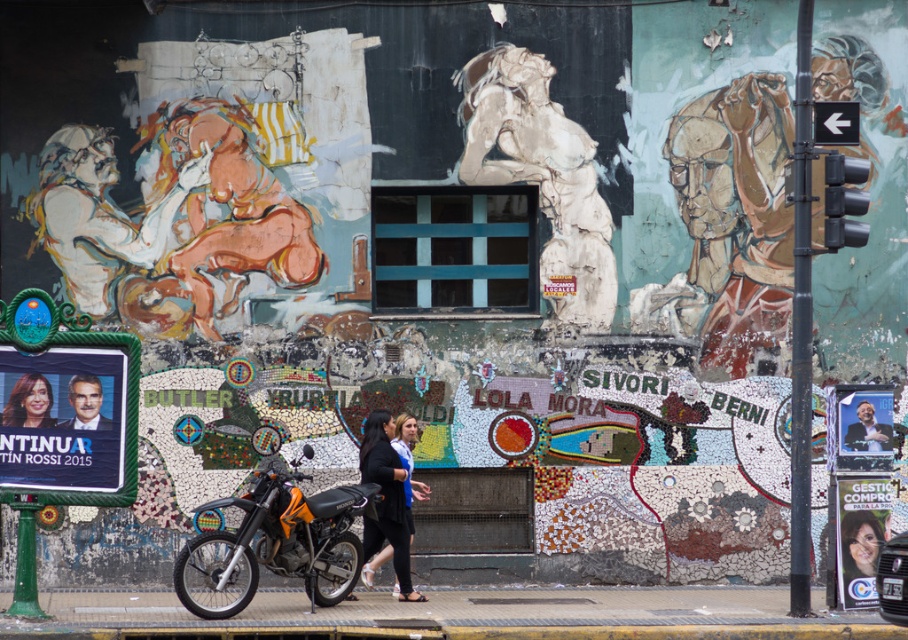
Question: Which of the following is the farthest from the observer?

Choices:
 (A) orange matte motorcycle at center
 (B) black leather jacket at center

Answer: (B)

Question: Among these points, which one is nearest to the camera?

Choices:
 (A) (373, 531)
 (B) (80, 428)

Answer: (B)

Question: Which object appears closest to the camera in this image?

Choices:
 (A) smooth skin face at center
 (B) orange matte motorcycle at center

Answer: (B)

Question: Is black leather jacket at center positioned behind smooth skin face at center?

Choices:
 (A) no
 (B) yes

Answer: (B)

Question: In this image, where is orange matte motorcycle at center located relative to smooth plastic sign at center?

Choices:
 (A) below
 (B) above

Answer: (A)

Question: In this image, where is orange matte motorcycle at center located relative to smooth skin portrait at center?

Choices:
 (A) below
 (B) above

Answer: (A)